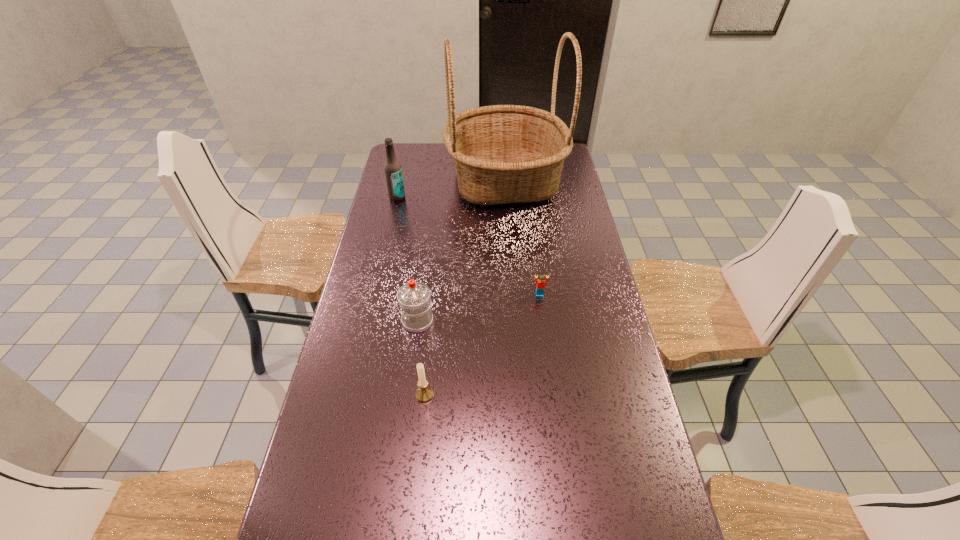
In order to click on basket in this screenshot , I will do `click(502, 154)`.

Where is `the fourth shortest object`? the fourth shortest object is located at coordinates (393, 172).

Find the location of `beer bottle`. beer bottle is located at coordinates (393, 172).

At what (x,y) coordinates should I click in order to perform the action: click on water bottle. Please return your answer as a coordinate pair (x, y). Looking at the image, I should click on (413, 297).

This screenshot has height=540, width=960. What are the coordinates of `the fourth farthest object` in the screenshot? It's located at (413, 297).

Where is `the fourth tallest object`? The width and height of the screenshot is (960, 540). the fourth tallest object is located at coordinates (424, 393).

The image size is (960, 540). I want to click on candle holder, so [x=424, y=393].

The width and height of the screenshot is (960, 540). Identify the location of the shortest object. (541, 281).

Where is `the third nearest object`? The image size is (960, 540). the third nearest object is located at coordinates (541, 281).

This screenshot has width=960, height=540. What are the coordinates of `vacant space located on the left of the tallest object` in the screenshot? It's located at (422, 181).